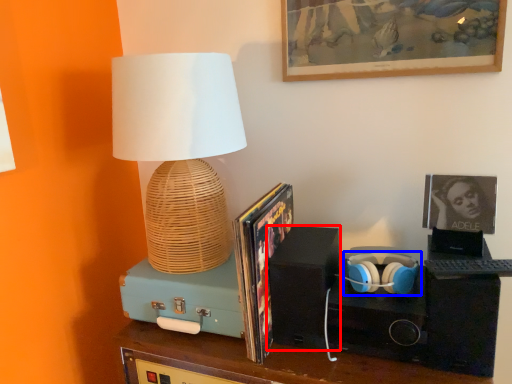
Question: Among these objects, which one is nearest to the camera, speaker (highlighted by a red box) or headphones (highlighted by a blue box)?

Choices:
 (A) speaker
 (B) headphones

Answer: (B)